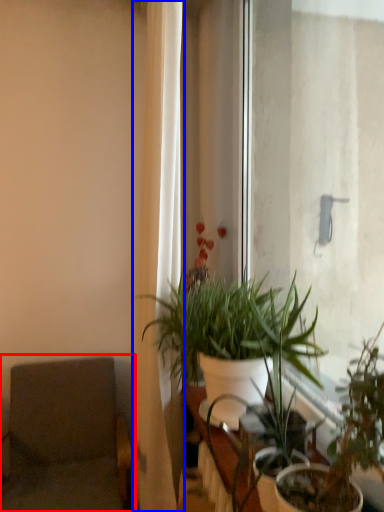
Question: Which object is closer to the camera taking this photo, swivel chair (highlighted by a red box) or curtain (highlighted by a blue box)?

Choices:
 (A) swivel chair
 (B) curtain

Answer: (B)